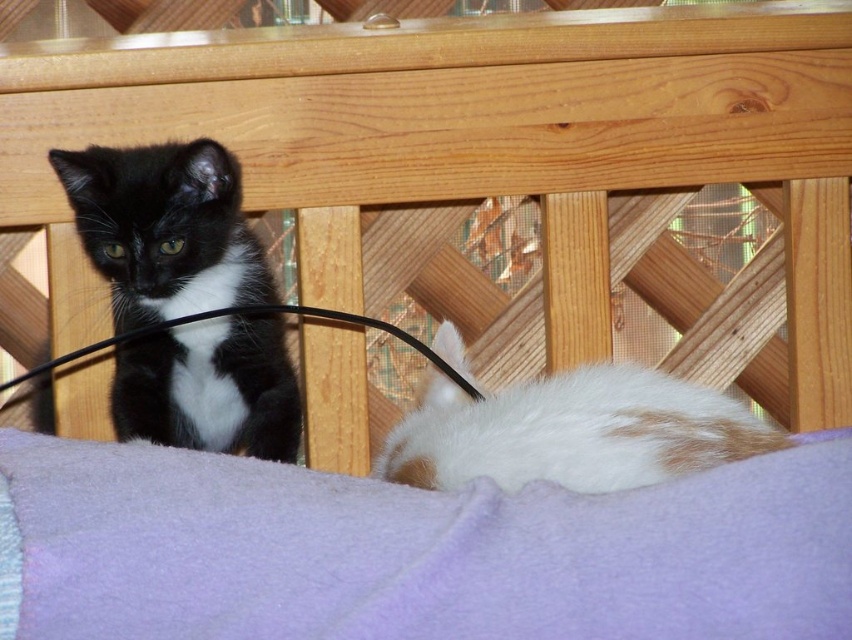
Question: Among these points, which one is nearest to the camera?

Choices:
 (A) (130, 464)
 (B) (450, 477)

Answer: (A)

Question: Which object is the farthest from the white fur at lower right?

Choices:
 (A) black fur/kitten at left
 (B) purple fleece blanket at lower center

Answer: (A)

Question: Which point appears closest to the camera in this image?

Choices:
 (A) (281, 323)
 (B) (611, 470)
 (C) (268, 616)

Answer: (C)

Question: Can you confirm if black fur/kitten at left is positioned below white fur at lower right?

Choices:
 (A) no
 (B) yes

Answer: (A)

Question: Is purple fleece blanket at lower center thinner than black fur/kitten at left?

Choices:
 (A) yes
 (B) no

Answer: (B)

Question: Is purple fleece blanket at lower center bigger than white fur at lower right?

Choices:
 (A) no
 (B) yes

Answer: (A)